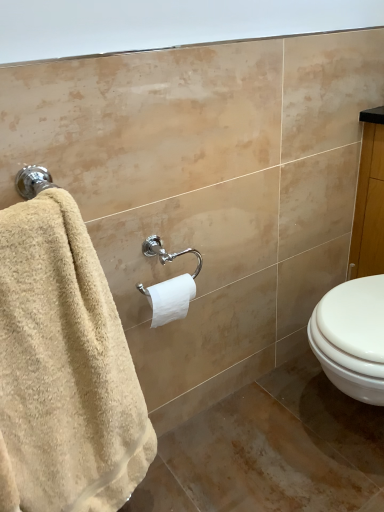
Question: In the image, is beige terry cloth towel at left on the left side or the right side of white matte toilet paper at center?

Choices:
 (A) left
 (B) right

Answer: (A)

Question: Relative to white matte toilet paper at center, is beige terry cloth towel at left in front or behind?

Choices:
 (A) front
 (B) behind

Answer: (A)

Question: Is beige terry cloth towel at left situated inside white matte toilet paper at center or outside?

Choices:
 (A) inside
 (B) outside

Answer: (B)

Question: Is white matte toilet paper at center wider or thinner than beige terry cloth towel at left?

Choices:
 (A) wide
 (B) thin

Answer: (B)

Question: Does point (152, 293) appear closer or farther from the camera than point (114, 305)?

Choices:
 (A) closer
 (B) farther

Answer: (A)

Question: Is white matte toilet paper at center taller or shorter than beige terry cloth towel at left?

Choices:
 (A) short
 (B) tall

Answer: (A)

Question: From a real-world perspective, relative to beige terry cloth towel at left, is white matte toilet paper at center vertically above or below?

Choices:
 (A) below
 (B) above

Answer: (B)